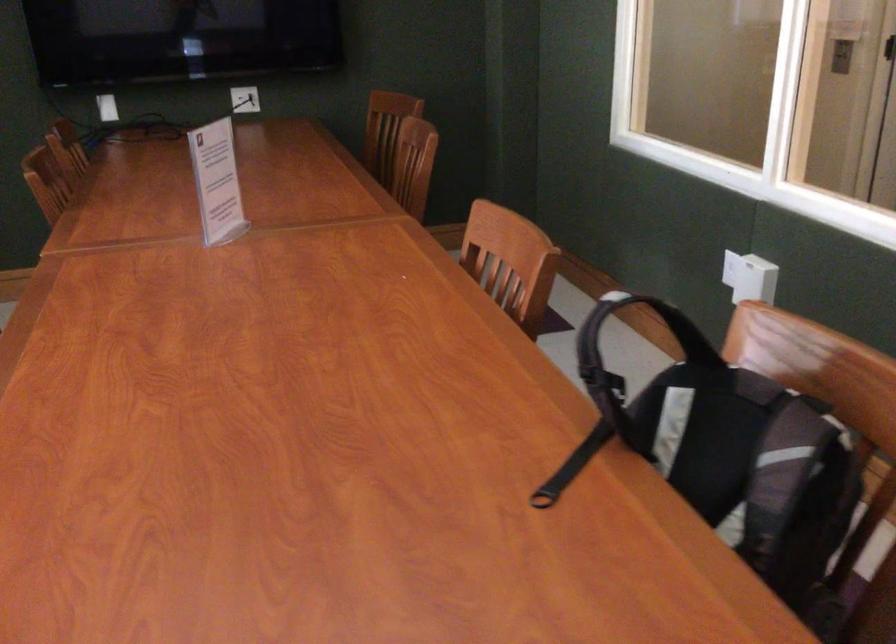
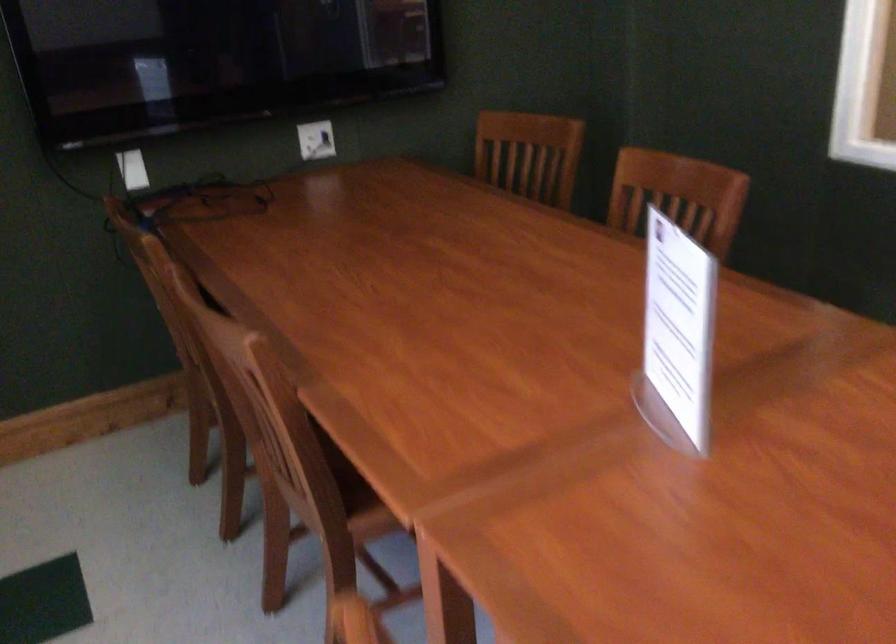
The point at (423, 147) is marked in the first image. Where is the corresponding point in the second image?

(677, 196)